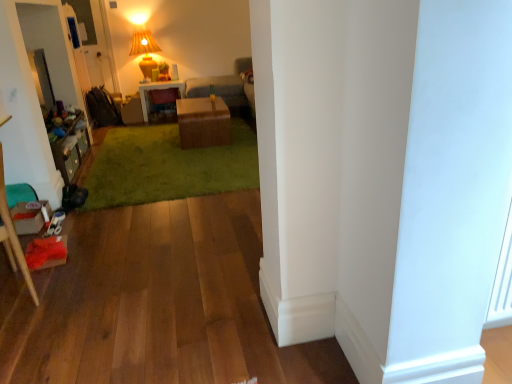
Question: From the image's perspective, is matte brown desk at center positioned above or below wooden stool at left?

Choices:
 (A) below
 (B) above

Answer: (B)

Question: Visually, is matte brown desk at center positioned to the left or to the right of wooden stool at left?

Choices:
 (A) left
 (B) right

Answer: (B)

Question: Estimate the real-world distances between objects in this image. Which object is farther from the wooden dresser at left?

Choices:
 (A) matte yellow fabric lampshade at upper center
 (B) green plush carpet at center
 (C) brown cardboard box at center
 (D) gray fabric couch at center
 (E) wooden stool at left

Answer: (A)

Question: Based on their relative distances, which object is nearer to the matte brown desk at center?

Choices:
 (A) green plush carpet at center
 (B) brown cardboard box at center
 (C) wooden stool at left
 (D) gray fabric couch at center
 (E) wooden dresser at left

Answer: (D)